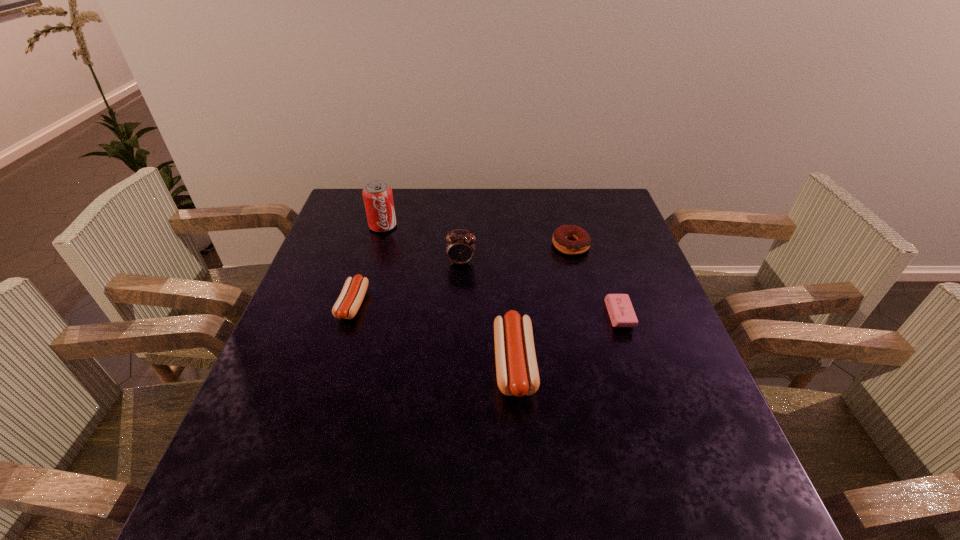
With all sausages evenly spaced, where should an extra sausage be placed on the right to continue the pattern? Please point out a vacant space. Please provide its 2D coordinates. Your answer should be formatted as a tuple, i.e. [(x, y)], where the tuple contains the x and y coordinates of a point satisfying the conditions above.

[(730, 443)]